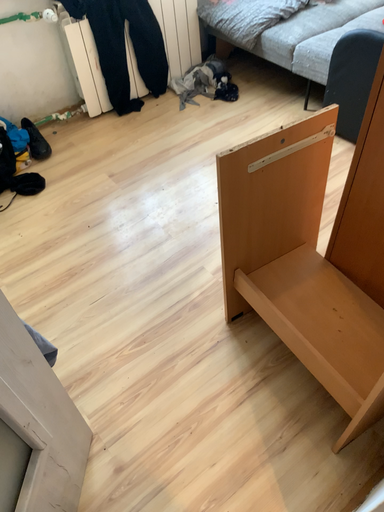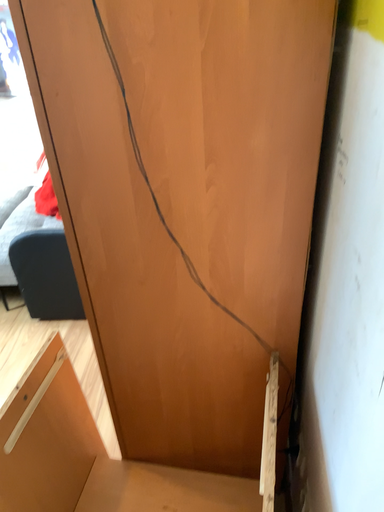
Question: How did the camera likely rotate when shooting the video?

Choices:
 (A) rotated right
 (B) rotated left

Answer: (A)